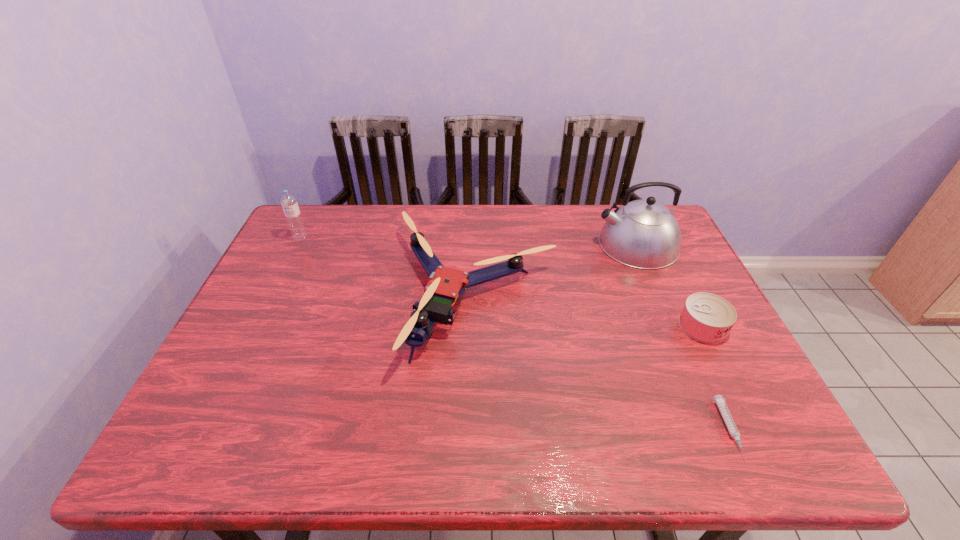
Locate an element on the screen. This screenshot has height=540, width=960. vacant space located from the spout of the tallest object is located at coordinates (551, 244).

Locate an element on the screen. The image size is (960, 540). free spot located 0.140m on the front of the water bottle is located at coordinates (283, 271).

Image resolution: width=960 pixels, height=540 pixels. Find the location of `free space located on the front of the second object from left to right`. free space located on the front of the second object from left to right is located at coordinates (474, 429).

Image resolution: width=960 pixels, height=540 pixels. In order to click on vacant space located 0.060m on the front of the can in this screenshot , I will do `click(721, 364)`.

At what (x,y) coordinates should I click in order to perform the action: click on kettle that is at the far edge. Please return your answer as a coordinate pair (x, y). The image size is (960, 540). Looking at the image, I should click on (644, 234).

At what (x,y) coordinates should I click in order to perform the action: click on water bottle at the far edge. Please return your answer as a coordinate pair (x, y). The width and height of the screenshot is (960, 540). Looking at the image, I should click on (293, 216).

Identify the location of drone located at the far edge. The height and width of the screenshot is (540, 960). (446, 285).

This screenshot has height=540, width=960. Identify the location of object present at the near edge. (719, 400).

Identify the location of object that is at the left edge. The width and height of the screenshot is (960, 540). (293, 216).

This screenshot has height=540, width=960. What are the coordinates of `kettle present at the right edge` in the screenshot? It's located at pos(644,234).